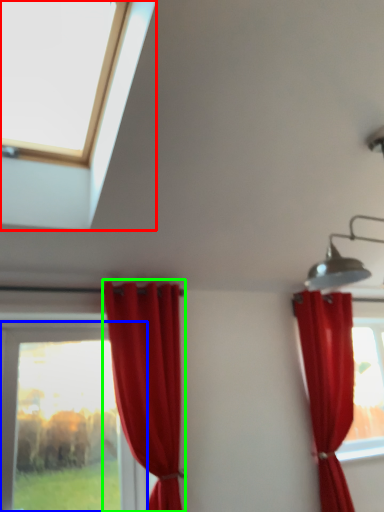
Question: Which object is the farthest from window (highlighted by a red box)? Choose among these: window (highlighted by a blue box) or curtain (highlighted by a green box).

Choices:
 (A) window
 (B) curtain

Answer: (A)